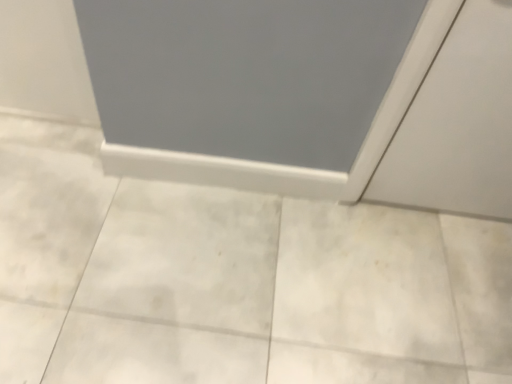
The image size is (512, 384). What do you see at coordinates (458, 123) in the screenshot? I see `white matte door at upper right` at bounding box center [458, 123].

This screenshot has width=512, height=384. In order to click on white matte door at upper right in this screenshot , I will do `click(458, 123)`.

Where is `white matte door at upper right`? This screenshot has width=512, height=384. white matte door at upper right is located at coordinates (458, 123).